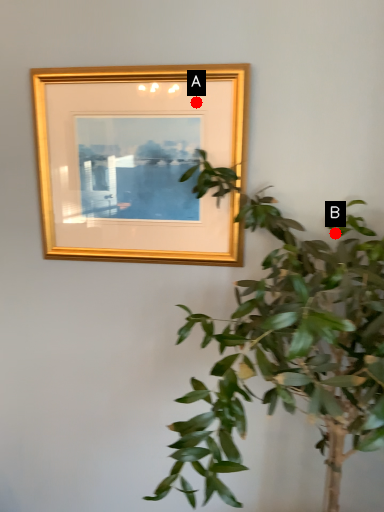
Question: Two points are circled on the image, labeled by A and B beside each circle. Which of the following is the farthest from the observer?

Choices:
 (A) A is further
 (B) B is further

Answer: (B)